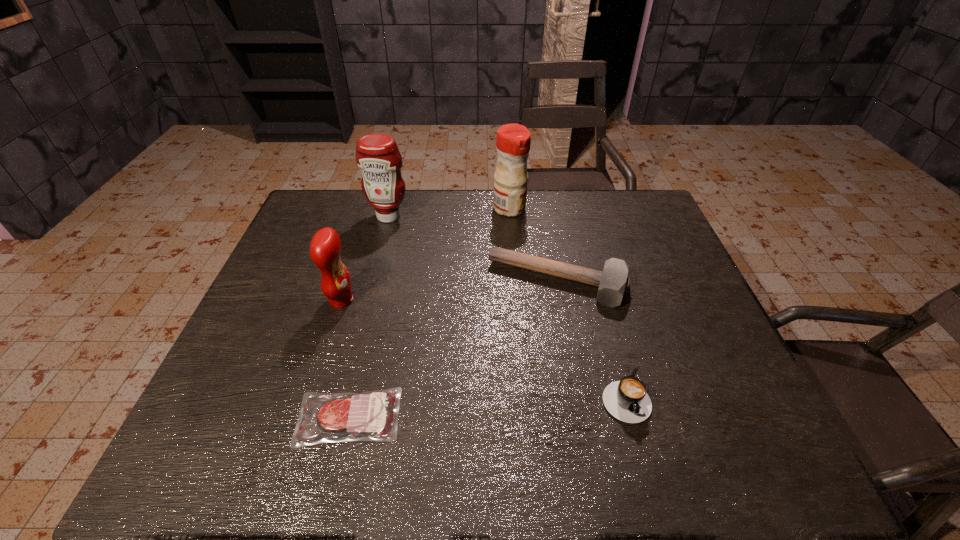
Find the location of a particular element. This screenshot has width=960, height=540. the rightmost condiment is located at coordinates (513, 141).

Where is `the fourth shortest object`? This screenshot has width=960, height=540. the fourth shortest object is located at coordinates (325, 246).

Locate an element on the screen. Image resolution: width=960 pixels, height=540 pixels. the shortest condiment is located at coordinates pos(325,246).

I want to click on mallet, so click(613, 282).

At what (x,y) coordinates should I click in order to perform the action: click on cappuccino. Please return your answer as a coordinate pair (x, y). This screenshot has height=540, width=960. Looking at the image, I should click on (627, 400).

This screenshot has width=960, height=540. In order to click on the shortest object in this screenshot , I will do click(x=373, y=415).

Where is `vacant area located on the right of the rightmost condiment`? This screenshot has height=540, width=960. vacant area located on the right of the rightmost condiment is located at coordinates (543, 208).

Identify the location of free location located on the label side of the nearest condiment. The width and height of the screenshot is (960, 540). (465, 300).

The height and width of the screenshot is (540, 960). Identify the location of vacant space situated 0.110m on the right of the mallet. (666, 281).

Where is `blank space located 0.070m with the handle on the side of the cappuccino`? Image resolution: width=960 pixels, height=540 pixels. blank space located 0.070m with the handle on the side of the cappuccino is located at coordinates (641, 458).